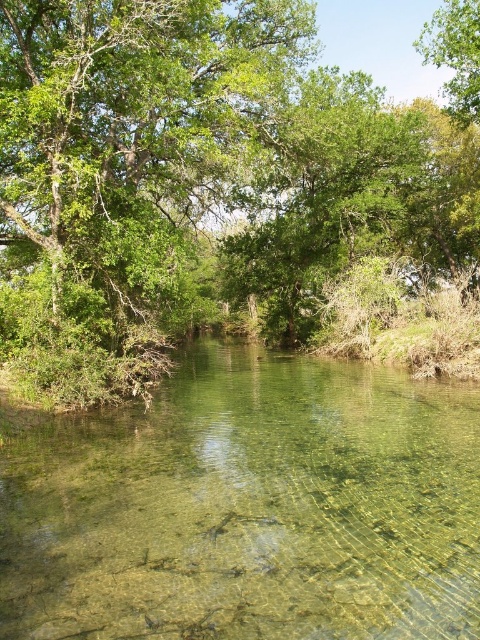
In the scene shown: Does clear glassy river at center have a greater width compared to green leafy tree at upper right?

Yes.

Does clear glassy river at center have a lesser height compared to green leafy tree at upper right?

Indeed, clear glassy river at center has a lesser height compared to green leafy tree at upper right.

This screenshot has width=480, height=640. I want to click on clear glassy river at center, so click(249, 508).

Between green leafy tree at center and clear glassy river at center, which one is positioned higher?

green leafy tree at center

Does green leafy tree at center have a lesser width compared to clear glassy river at center?

No, green leafy tree at center is not thinner than clear glassy river at center.

You are a GUI agent. You are given a task and a screenshot of the screen. Output one action in this format:
    pyautogui.click(x=<x>, y=<y>)
    Task: Click on the green leafy tree at center
    
    Given the screenshot: What is the action you would take?
    pyautogui.click(x=216, y=193)

Between green leafy tree at center and green leafy tree at upper right, which one appears on the right side from the viewer's perspective?

Positioned to the right is green leafy tree at upper right.

Is point (365, 208) in front of point (479, 51)?

That is False.

Find the location of a particular element. This screenshot has width=480, height=640. green leafy tree at center is located at coordinates (216, 193).